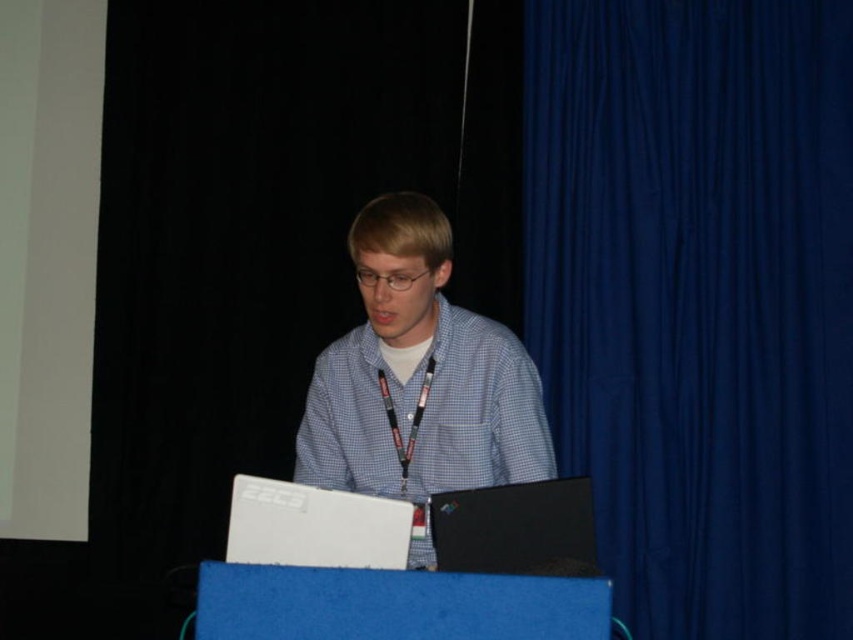
Question: Does blue fabric curtain at right come behind black matte laptop at center?

Choices:
 (A) no
 (B) yes

Answer: (B)

Question: Where is matte white shirt at center located in relation to black matte laptop at center in the image?

Choices:
 (A) right
 (B) left

Answer: (B)

Question: In this image, where is blue fabric curtain at right located relative to white plastic laptop at center?

Choices:
 (A) below
 (B) above

Answer: (B)

Question: Which point is closer to the camera?

Choices:
 (A) (527, 410)
 (B) (579, 60)

Answer: (A)

Question: Considering the real-world distances, which object is farthest from the white plastic laptop at center?

Choices:
 (A) matte white shirt at center
 (B) blue fabric curtain at right

Answer: (B)

Question: Which object is the closest to the matte white shirt at center?

Choices:
 (A) white plastic laptop at center
 (B) black matte laptop at center
 (C) blue fabric curtain at right

Answer: (B)